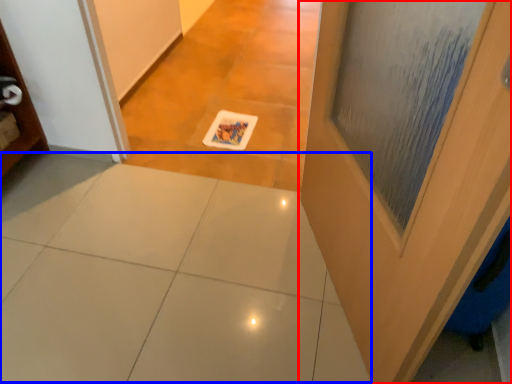
Question: Which of the following is the farthest to the observer, door (highlighted by a red box) or ceramic tile (highlighted by a blue box)?

Choices:
 (A) door
 (B) ceramic tile

Answer: (B)